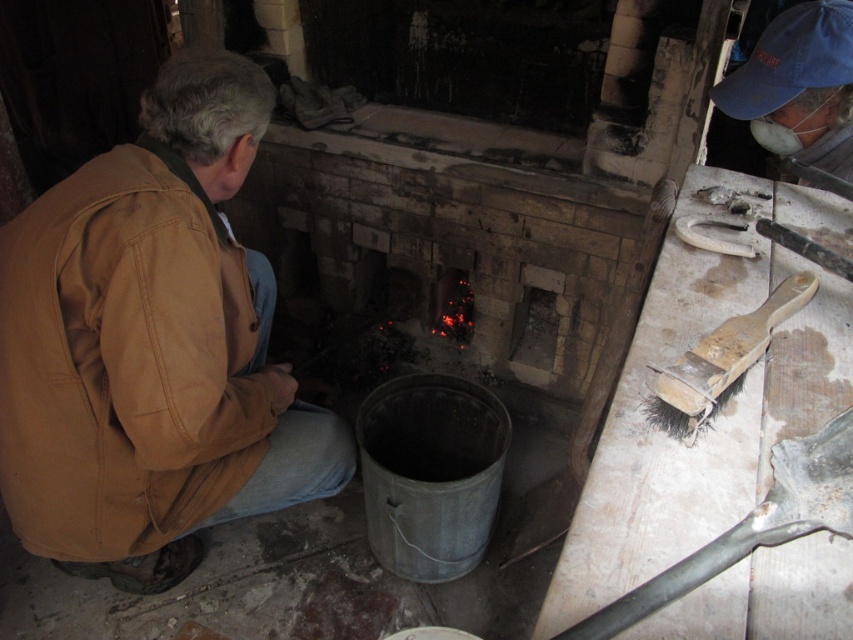
You are a worker in the forge and need to reach the blue fabric cap at upper right to put it on your head. Considering your arm length is 0.7 meters, can you reach it from your current position?

The blue fabric cap at upper right is 1.42 meters away from you. Since your arm length is only 0.7 meters, you cannot reach it without moving closer.

You are standing in the workshop and need to place a new tool on the floor near the brown cotton jacket at lower left. Where should you place it?

Place the new tool near the coordinates (151, 346) where the brown cotton jacket at lower left is located.